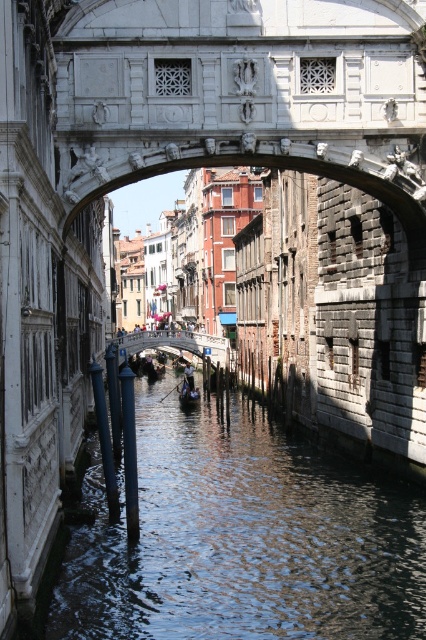
Question: Is wooden dark blue boat at center smaller than wooden gondola at center?

Choices:
 (A) no
 (B) yes

Answer: (B)

Question: Is clear water at center positioned in front of wooden dark blue boat at center?

Choices:
 (A) yes
 (B) no

Answer: (A)

Question: Which object is the farthest from the wooden dark blue boat at center?

Choices:
 (A) white stone bridge at center
 (B) clear water at center
 (C) wooden gondola at center
 (D) smooth white pole at center

Answer: (B)

Question: Is smooth white pole at center to the left of smooth gray pole at lower center from the viewer's perspective?

Choices:
 (A) no
 (B) yes

Answer: (B)

Question: Which object appears farthest from the camera in this image?

Choices:
 (A) smooth gray pole at lower center
 (B) wooden dark blue boat at center
 (C) white stone bridge at center

Answer: (C)

Question: Which point is closer to the camera?

Choices:
 (A) white stone bridge at center
 (B) wooden dark blue boat at center
 (C) smooth gray pole at lower center

Answer: (C)